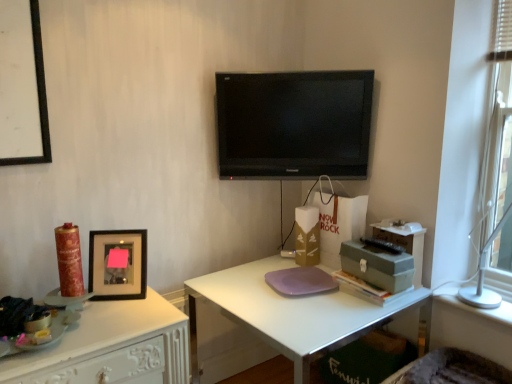
Question: Is fuzzy fabric swivel chair at lower right in front of or behind matte green box at right, the second box positioned from the right, in the image?

Choices:
 (A) front
 (B) behind

Answer: (A)

Question: From their relative heights in the image, would you say fuzzy fabric swivel chair at lower right is taller or shorter than matte green box at right, the second box positioned from the right?

Choices:
 (A) short
 (B) tall

Answer: (A)

Question: Estimate the real-world distances between objects in this image. Which object is farther from the shiny gold candle at left?

Choices:
 (A) fuzzy fabric swivel chair at lower right
 (B) white matte desk at center, positioned as the 1th desk in right-to-left order
 (C) black matte picture frame at upper left
 (D) black glossy flat-screen tv at center
 (E) white glossy desk at left, placed as the 2th desk when sorted from right to left

Answer: (A)

Question: Which is farther from the black matte picture frame at upper left?

Choices:
 (A) matte gray box at right, which ranks as the 2th box in left-to-right order
 (B) shiny gold candle at left
 (C) matte green box at right, arranged as the first box when viewed from the left
 (D) white glossy desk at left, the first desk in the left-to-right sequence
 (E) fuzzy fabric swivel chair at lower right

Answer: (E)